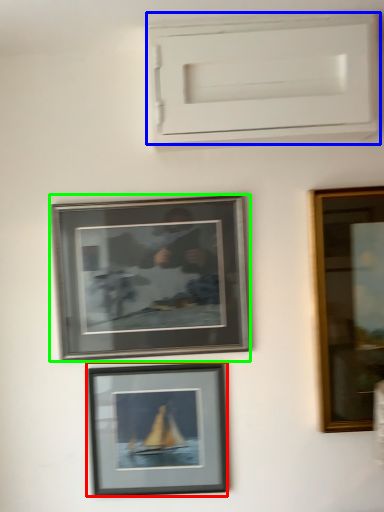
Question: Estimate the real-world distances between objects in this image. Which object is farther from picture frame (highlighted by a red box), window frame (highlighted by a blue box) or picture frame (highlighted by a green box)?

Choices:
 (A) window frame
 (B) picture frame

Answer: (A)